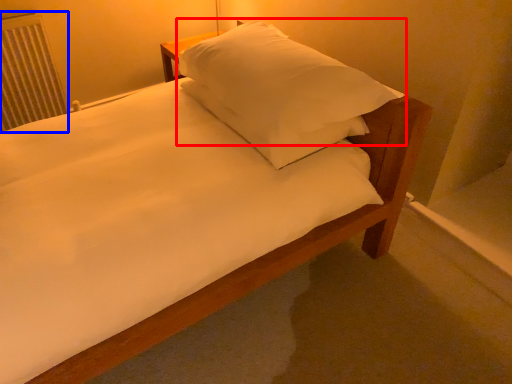
Question: Which of the following is the farthest to the observer, pillow (highlighted by a red box) or radiator (highlighted by a blue box)?

Choices:
 (A) pillow
 (B) radiator

Answer: (B)